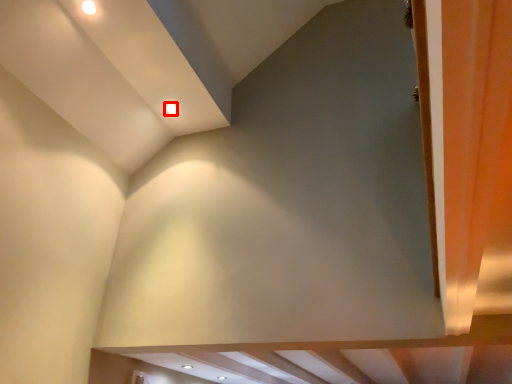
Question: From the image's perspective, what is the correct spatial relationship of lighting (annotated by the red box) in relation to curtain?

Choices:
 (A) below
 (B) above

Answer: (B)